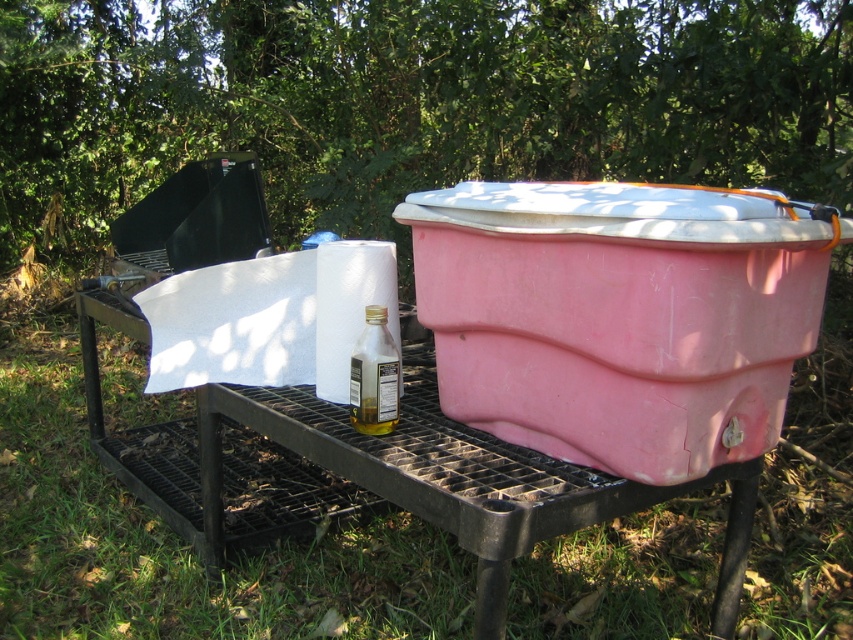
You are standing in front of the grill and want to pick up an item. Which of the two points, point (120, 557) or point (373, 312), is closer to you?

Point (120, 557) is closer to you because it is further to the viewer than point (373, 312).

You are standing 40 inches away from a picnic table and want to reach the pink plastic cooler at center to grab some drinks. Can you comfortably reach it without moving your feet?

The pink plastic cooler at center is 37.25 inches away from the viewer. Since you are standing 40 inches away from the picnic table, the cooler is slightly closer to you than the table. You can comfortably reach the pink plastic cooler at center without moving your feet.

You are a gardener holding a 1.2 meter long garden tool. You need to place it between the green grass at lower left and the clear glass bottle at center. Can you fit it there?

The distance between the green grass at lower left and the clear glass bottle at center is 1.21 meters. Since the garden tool is 1.2 meters long, it can fit in the space between them.